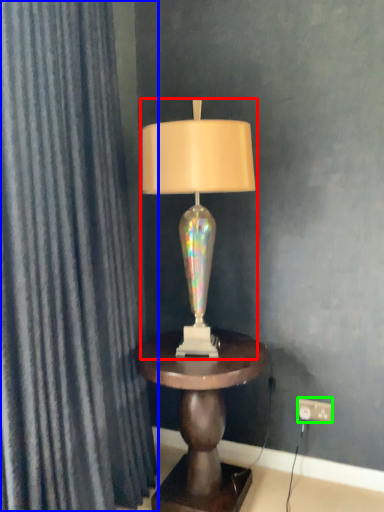
Question: Estimate the real-world distances between objects in this image. Which object is farther from lamp (highlighted by a red box), curtain (highlighted by a blue box) or electric outlet (highlighted by a green box)?

Choices:
 (A) curtain
 (B) electric outlet

Answer: (B)